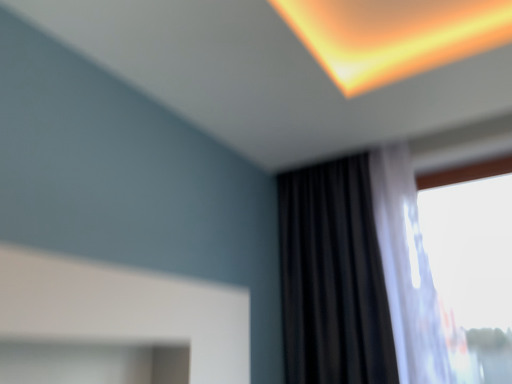
What do you see at coordinates (333, 277) in the screenshot? Image resolution: width=512 pixels, height=384 pixels. I see `black velvet curtain at right` at bounding box center [333, 277].

Identify the location of black velvet curtain at right. (333, 277).

Locate an element on the screen. The height and width of the screenshot is (384, 512). black velvet curtain at right is located at coordinates (333, 277).